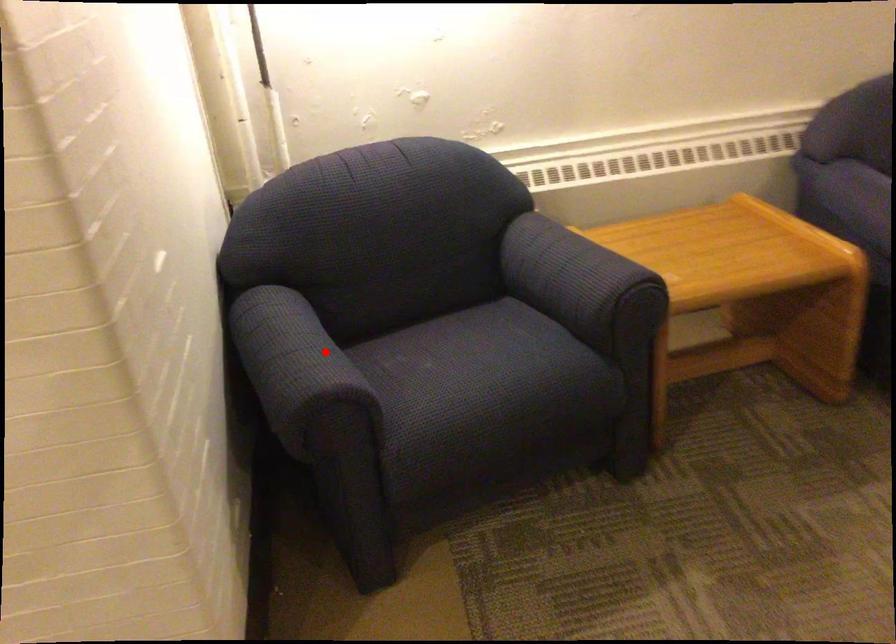
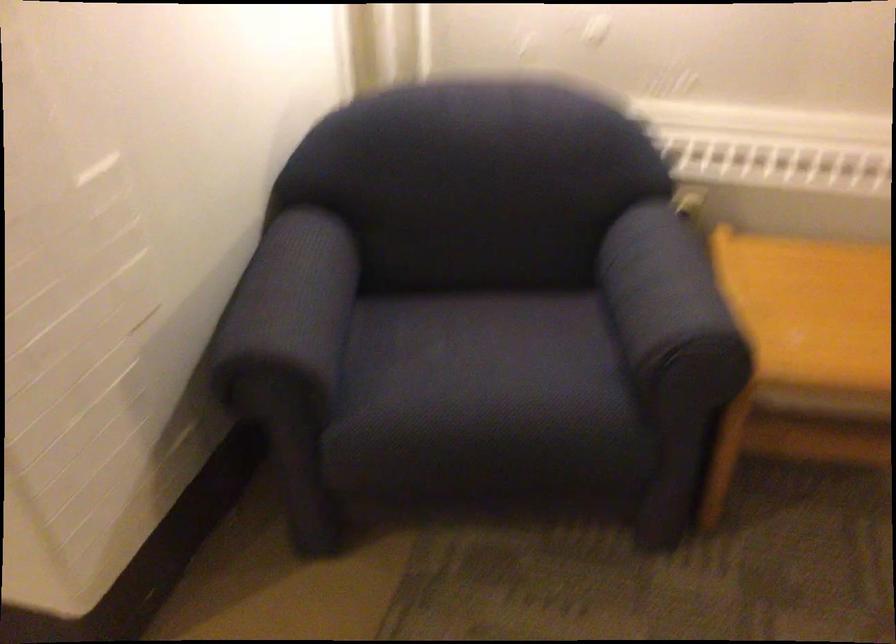
The point at the highlighted location is marked in the first image. Where is the corresponding point in the second image?

(289, 307)